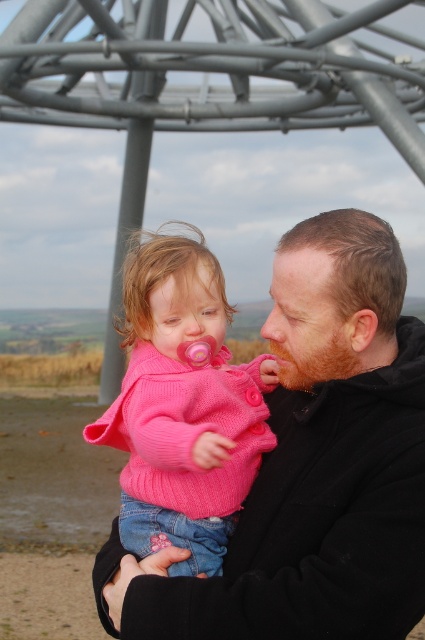
Question: Is black matte jacket at center positioned at the back of pink knitted sweater at center?

Choices:
 (A) no
 (B) yes

Answer: (B)

Question: Observing the image, what is the correct spatial positioning of black matte jacket at center in reference to pink knitted sweater at center?

Choices:
 (A) left
 (B) right

Answer: (B)

Question: Among these objects, which one is farthest from the camera?

Choices:
 (A) black matte jacket at center
 (B) pink knitted sweater at center

Answer: (A)

Question: In this image, where is black matte jacket at center located relative to pink knitted sweater at center?

Choices:
 (A) above
 (B) below

Answer: (B)

Question: Which point appears closest to the camera in this image?

Choices:
 (A) pyautogui.click(x=163, y=420)
 (B) pyautogui.click(x=260, y=600)

Answer: (B)